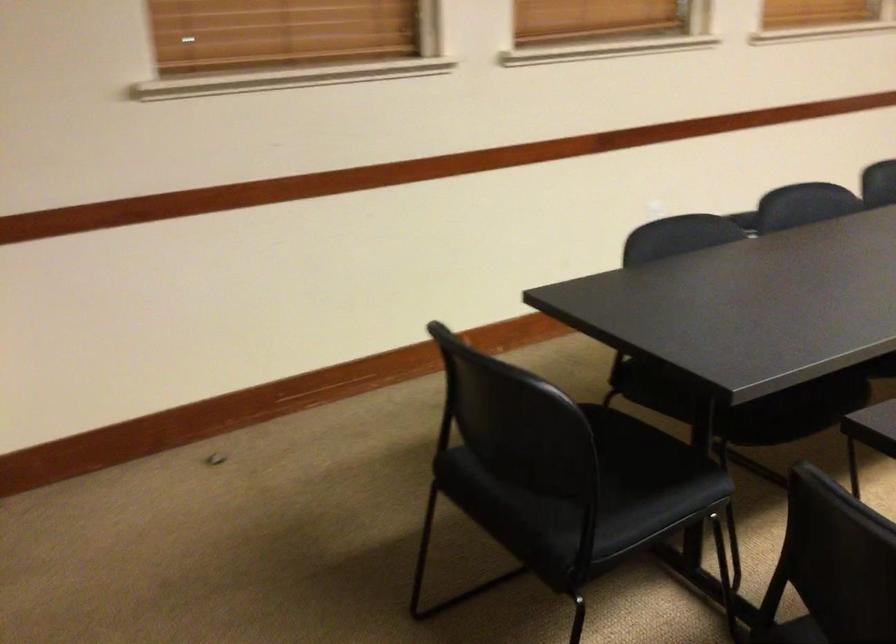
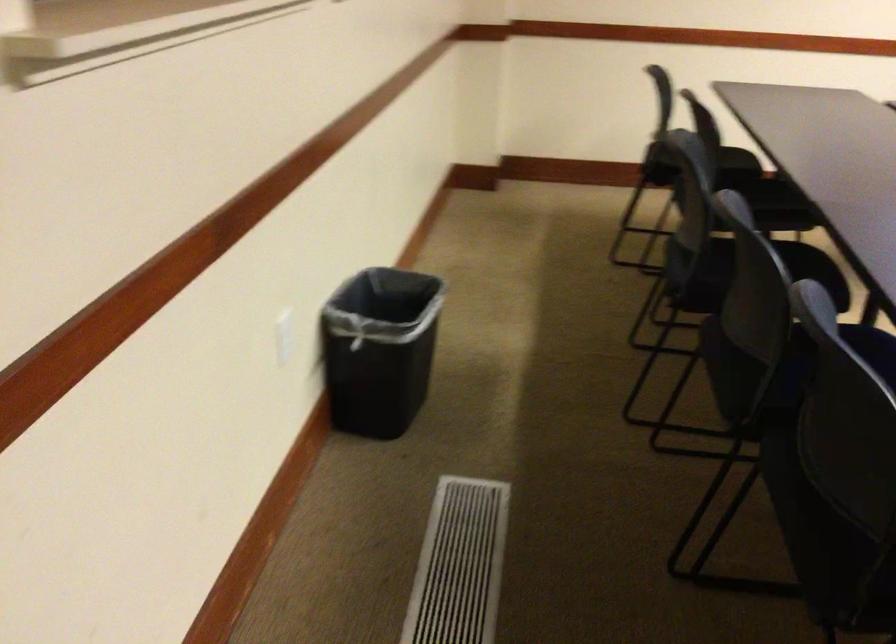
Question: Which direction would the cameraman need to move to produce the second image? Reply with the corresponding letter.

Choices:
 (A) Left
 (B) Right
 (C) Forward
 (D) Backward

Answer: (D)